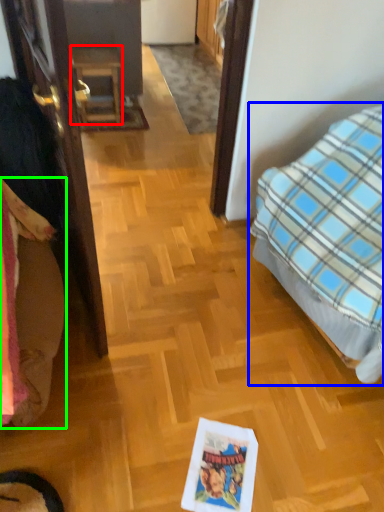
Question: Which object is the closest to the furniture (highlighted by a red box)? Choose among these: bed (highlighted by a blue box) or bedding (highlighted by a green box).

Choices:
 (A) bed
 (B) bedding

Answer: (A)